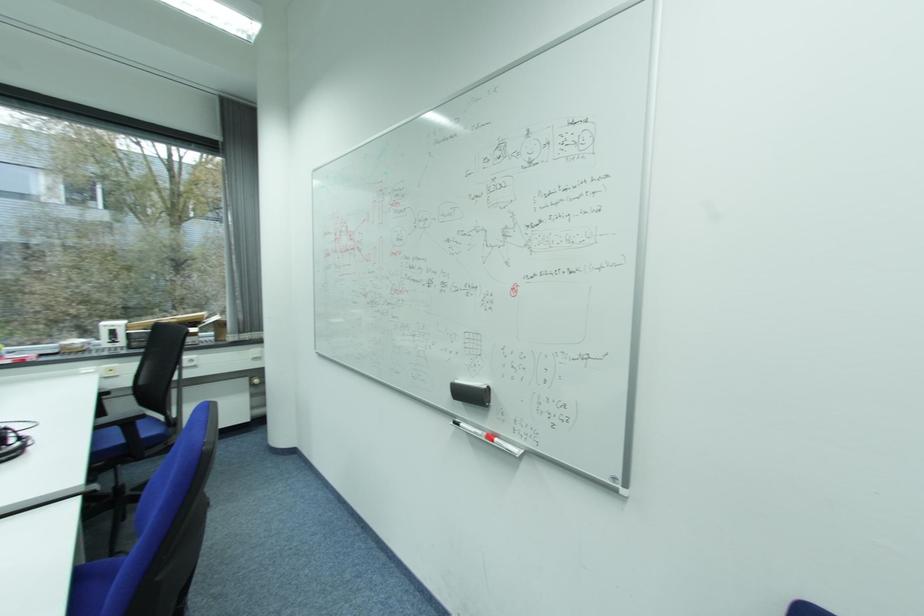
Image resolution: width=924 pixels, height=616 pixels. What are the coordinates of `blue chair sitting surface` in the screenshot? It's located at (186, 549).